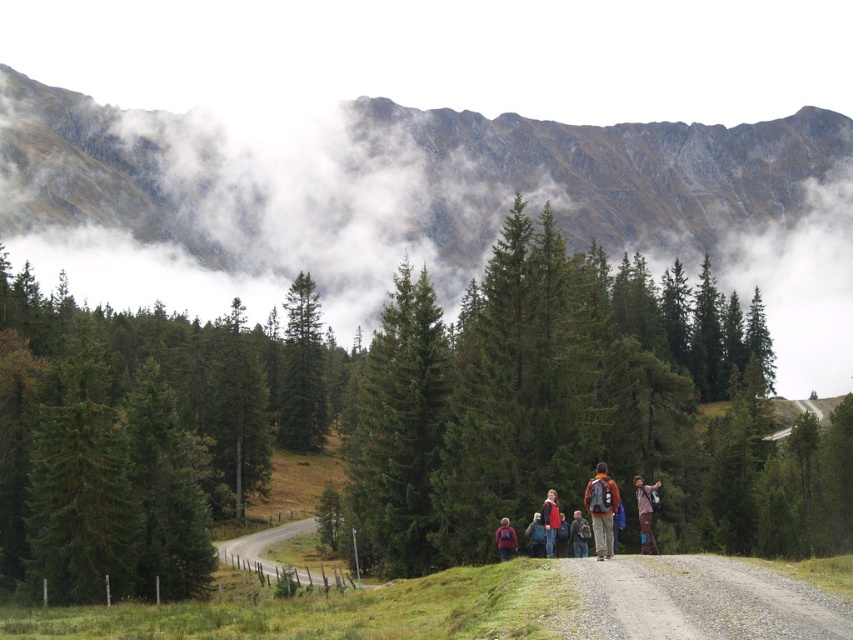
You are standing at the starting point of the gravel path and see the orange backpack at center ahead of you. If you walk straight towards it, will you encounter any obstacles like fences or trees blocking your path?

The orange backpack at center is 48.44 meters away from you. Since the path is well trodden and curves slightly to the left in the distance, there are no fences or trees blocking your direct path to the orange backpack at center.